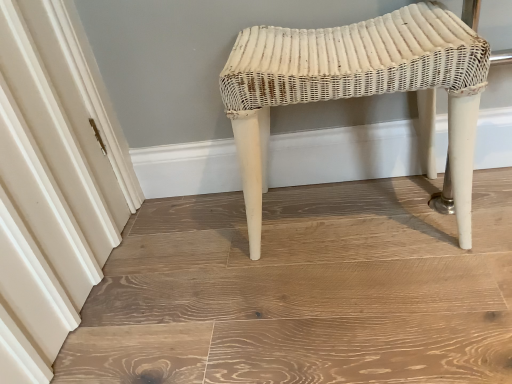
Locate an element on the screen. blank space to the left of white wicker stool at center is located at coordinates (204, 259).